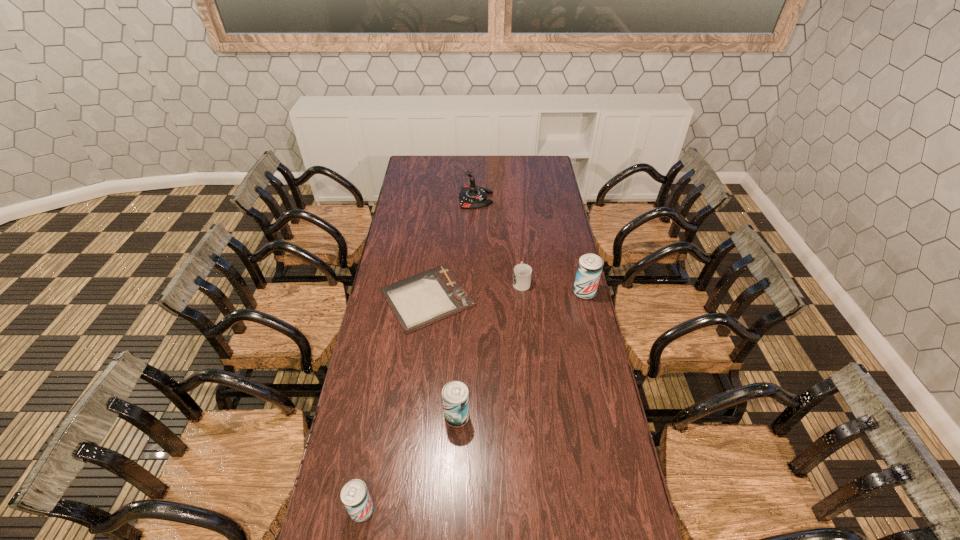
Where is `free space located 0.300m on the right of the nearest beer can`? This screenshot has height=540, width=960. free space located 0.300m on the right of the nearest beer can is located at coordinates (477, 510).

Where is `free region located on the back of the fifth farthest object`? free region located on the back of the fifth farthest object is located at coordinates (460, 335).

Where is `vacant space located on the left of the rightmost beer can`? Image resolution: width=960 pixels, height=540 pixels. vacant space located on the left of the rightmost beer can is located at coordinates (557, 292).

Where is `vacant area situated on the handle side of the farthest object`? The height and width of the screenshot is (540, 960). vacant area situated on the handle side of the farthest object is located at coordinates (522, 198).

You are a GUI agent. You are given a task and a screenshot of the screen. Output one action in this format:
    pyautogui.click(x=<x>, y=<y>)
    Task: Click on the free spot located 0.090m on the front of the clipboard
    
    Given the screenshot: What is the action you would take?
    pyautogui.click(x=420, y=354)

The height and width of the screenshot is (540, 960). I want to click on vacant space positioned 0.150m on the side of the second object from right to left where the handle is located, so click(x=518, y=252).

The height and width of the screenshot is (540, 960). Identify the location of vacant space situated 0.110m on the side of the second object from right to left where the handle is located. (519, 258).

At what (x,y) coordinates should I click in order to perform the action: click on free space located on the side of the second object from right to left where the handle is located. Please return your answer as a coordinate pair (x, y). The width and height of the screenshot is (960, 540). Looking at the image, I should click on [516, 227].

This screenshot has width=960, height=540. I want to click on object at the near edge, so click(x=355, y=496).

Where is `beer can present at the left edge`? The width and height of the screenshot is (960, 540). beer can present at the left edge is located at coordinates (355, 496).